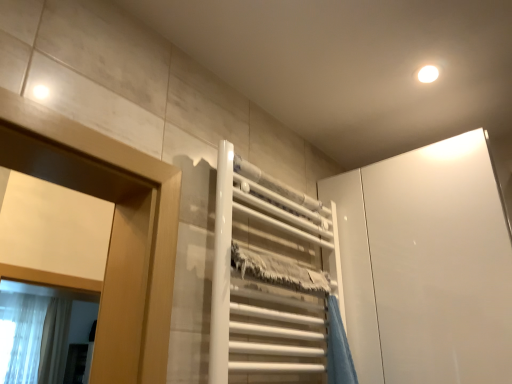
What is the approximate width of translucent fabric shower curtain at lower left?

translucent fabric shower curtain at lower left is 23.08 centimeters in width.

What is the approximate height of white glossy cabinet at upper right?

28.86 inches.

This screenshot has width=512, height=384. What do you see at coordinates (269, 278) in the screenshot? I see `white glossy towel rack at center` at bounding box center [269, 278].

This screenshot has width=512, height=384. Find the location of `translucent fabric shower curtain at lower left`. translucent fabric shower curtain at lower left is located at coordinates (35, 338).

Considering the positions of objects white glossy cabinet at upper right and translucent fabric shower curtain at lower left in the image provided, who is more to the left, white glossy cabinet at upper right or translucent fabric shower curtain at lower left?

translucent fabric shower curtain at lower left is more to the left.

Does point (441, 317) come farther from viewer compared to point (47, 332)?

No, it is in front of (47, 332).

From the image's perspective, is white glossy cabinet at upper right located above or below translucent fabric shower curtain at lower left?

Clearly, from the image's perspective, white glossy cabinet at upper right is above translucent fabric shower curtain at lower left.

Looking at this image, would you say white glossy cabinet at upper right contains white glossy towel rack at center?

No.

Is white glossy cabinet at upper right turned away from white glossy towel rack at center?

No.

This screenshot has width=512, height=384. In the image, there is a white glossy cabinet at upper right. What are the coordinates of `elevator above it (from the image's perspective)` in the screenshot? It's located at (269, 278).

Who is taller, white glossy cabinet at upper right or white glossy towel rack at center?

white glossy cabinet at upper right is taller.

Between translucent fabric shower curtain at lower left and white glossy cabinet at upper right, which one has less height?

Standing shorter between the two is white glossy cabinet at upper right.

Is translucent fabric shower curtain at lower left facing towards white glossy cabinet at upper right?

Yes, translucent fabric shower curtain at lower left is facing white glossy cabinet at upper right.

From a real-world perspective, does translucent fabric shower curtain at lower left stand above white glossy cabinet at upper right?

Yes, from a real-world perspective, translucent fabric shower curtain at lower left is above white glossy cabinet at upper right.

Can you tell me how much translucent fabric shower curtain at lower left and white glossy towel rack at center differ in facing direction?

1.77 degrees.

Is translucent fabric shower curtain at lower left next to white glossy towel rack at center and touching it?

No.

Which is in front, translucent fabric shower curtain at lower left or white glossy towel rack at center?

white glossy towel rack at center is closer to the camera.

Would you say translucent fabric shower curtain at lower left is inside or outside white glossy towel rack at center?

translucent fabric shower curtain at lower left is not inside white glossy towel rack at center, it's outside.

Who is bigger, white glossy towel rack at center or translucent fabric shower curtain at lower left?

With larger size is translucent fabric shower curtain at lower left.

Identify the location of elevator in front of the translucent fabric shower curtain at lower left. (269, 278).

Considering the relative positions of white glossy towel rack at center and translucent fabric shower curtain at lower left in the image provided, is white glossy towel rack at center to the left of translucent fabric shower curtain at lower left from the viewer's perspective?

No, white glossy towel rack at center is not to the left of translucent fabric shower curtain at lower left.

What's the angular difference between white glossy towel rack at center and translucent fabric shower curtain at lower left's facing directions?

white glossy towel rack at center and translucent fabric shower curtain at lower left are facing 1.77 degrees away from each other.

Looking at the image, does white glossy towel rack at center seem bigger or smaller compared to white glossy cabinet at upper right?

Considering their sizes, white glossy towel rack at center takes up less space than white glossy cabinet at upper right.

Where is `screen door that is on the right side of white glossy towel rack at center`? Image resolution: width=512 pixels, height=384 pixels. screen door that is on the right side of white glossy towel rack at center is located at coordinates (426, 265).

From the image's perspective, does white glossy towel rack at center appear lower than white glossy cabinet at upper right?

Actually, white glossy towel rack at center appears above white glossy cabinet at upper right in the image.

This screenshot has height=384, width=512. Identify the location of shower curtain on the left of white glossy cabinet at upper right. (35, 338).

Find the location of a particular element. Image resolution: width=512 pixels, height=384 pixels. screen door that is on the right side of white glossy towel rack at center is located at coordinates (426, 265).

From the image, which object appears to be nearer to translucent fabric shower curtain at lower left, white glossy towel rack at center or white glossy cabinet at upper right?

white glossy towel rack at center is positioned closer to the anchor translucent fabric shower curtain at lower left.

Estimate the real-world distances between objects in this image. Which object is closer to white glossy towel rack at center, white glossy cabinet at upper right or translucent fabric shower curtain at lower left?

The object closer to white glossy towel rack at center is white glossy cabinet at upper right.

When comparing their distances from white glossy cabinet at upper right, does translucent fabric shower curtain at lower left or white glossy towel rack at center seem further?

The object further to white glossy cabinet at upper right is translucent fabric shower curtain at lower left.

Looking at the image, which one is located further to white glossy towel rack at center, translucent fabric shower curtain at lower left or white glossy cabinet at upper right?

translucent fabric shower curtain at lower left lies further to white glossy towel rack at center than the other object.

Which object lies further to the anchor point white glossy cabinet at upper right, white glossy towel rack at center or translucent fabric shower curtain at lower left?

translucent fabric shower curtain at lower left is further to white glossy cabinet at upper right.

From the picture: When comparing their distances from translucent fabric shower curtain at lower left, does white glossy cabinet at upper right or white glossy towel rack at center seem further?

white glossy cabinet at upper right.

Where is `screen door between white glossy towel rack at center and translucent fabric shower curtain at lower left in the front-back direction`? screen door between white glossy towel rack at center and translucent fabric shower curtain at lower left in the front-back direction is located at coordinates (426, 265).